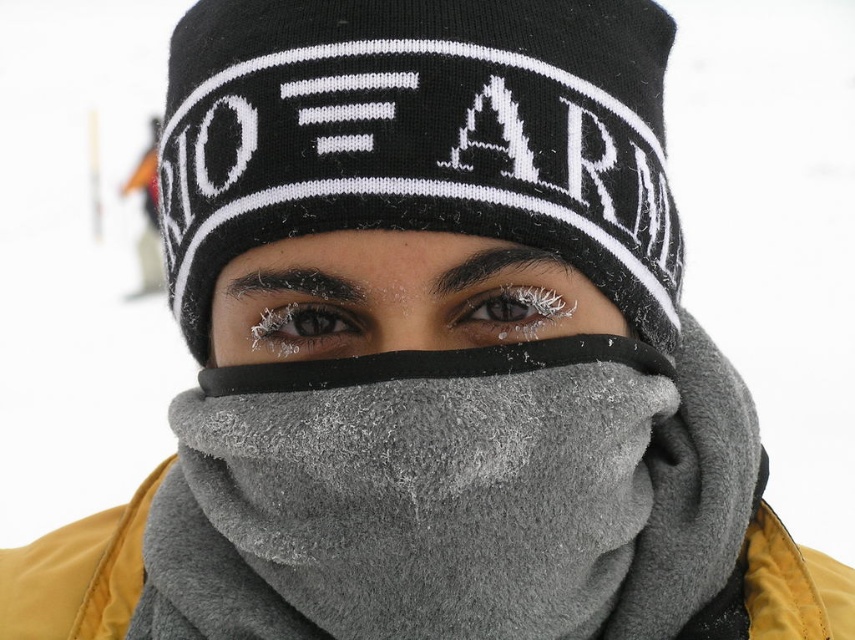
Who is lower down, frosted gray scarf at center or icy frost eyelashes at center?

frosted gray scarf at center

Locate an element on the screen. frosted gray scarf at center is located at coordinates (390, 294).

Measure the distance between point (461, 294) and camera.

Point (461, 294) and camera are 30.70 inches apart.

Identify the location of frosted gray scarf at center. The image size is (855, 640). 390,294.

This screenshot has height=640, width=855. I want to click on frosted skin at center, so click(405, 324).

In the scene shown: Can you confirm if frosted skin at center is positioned above icy frost eyelashes at center?

No, frosted skin at center is not above icy frost eyelashes at center.

Measure the distance between frosted skin at center and camera.

frosted skin at center and camera are 29.41 inches apart from each other.

Where is `frosted skin at center`? This screenshot has height=640, width=855. frosted skin at center is located at coordinates (405, 324).

Is yellow fleece jacket at center taller than frosted skin at center?

Correct, yellow fleece jacket at center is much taller as frosted skin at center.

Does yellow fleece jacket at center come behind frosted skin at center?

Yes.

Between point (146, 509) and point (390, 300), which one is positioned in front?

Point (390, 300)

I want to click on yellow fleece jacket at center, so click(77, 573).